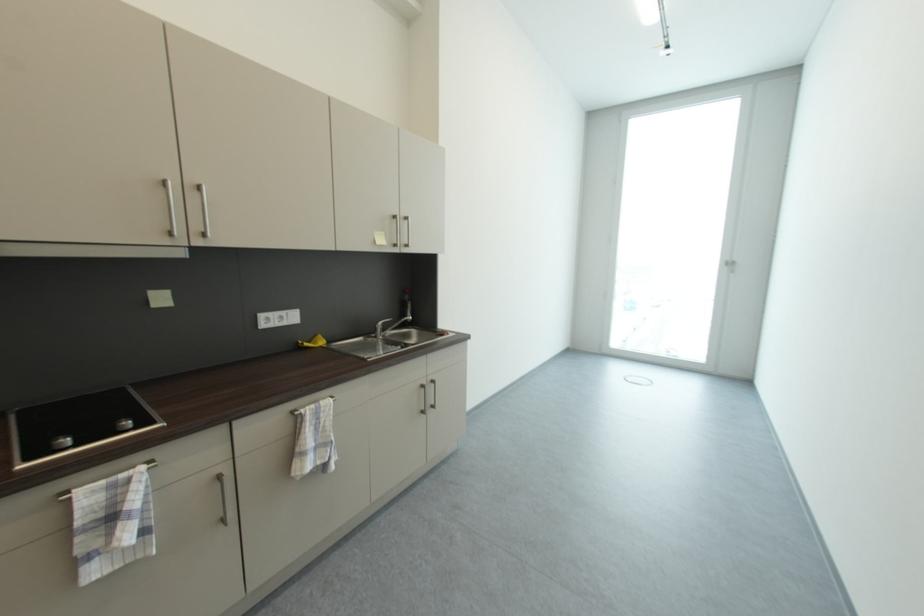
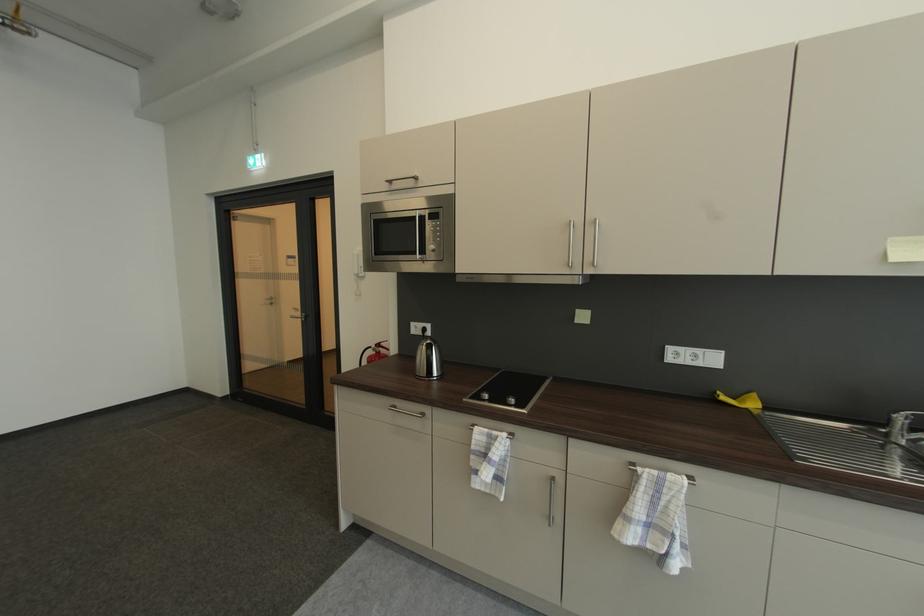
Question: The camera is either moving clockwise (left) or counter-clockwise (right) around the object. The first image is from the beginning of the video and the second image is from the end. Is the camera moving left or right when shooting the video?

Choices:
 (A) Left
 (B) Right

Answer: (B)